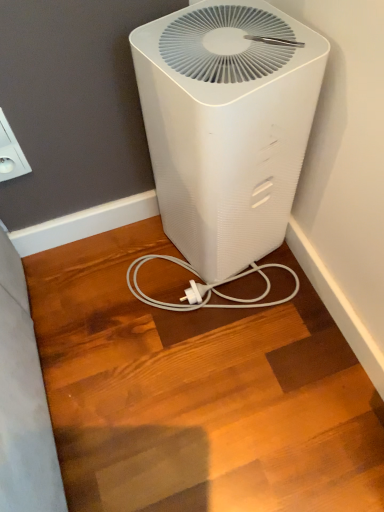
Question: Does white plastic air purifier at center turn towards white plastic outlet at upper left?

Choices:
 (A) yes
 (B) no

Answer: (B)

Question: Is white plastic air purifier at center bigger than white plastic outlet at upper left?

Choices:
 (A) yes
 (B) no

Answer: (A)

Question: Is white plastic air purifier at center shorter than white plastic outlet at upper left?

Choices:
 (A) no
 (B) yes

Answer: (A)

Question: Is white plastic air purifier at center not near white plastic outlet at upper left?

Choices:
 (A) no
 (B) yes

Answer: (A)

Question: Is white plastic outlet at upper left surrounded by white plastic air purifier at center?

Choices:
 (A) yes
 (B) no

Answer: (B)

Question: Is white plastic air purifier at center smaller than white plastic outlet at upper left?

Choices:
 (A) no
 (B) yes

Answer: (A)

Question: Considering the relative sizes of white plastic outlet at upper left and white plastic air purifier at center in the image provided, is white plastic outlet at upper left smaller than white plastic air purifier at center?

Choices:
 (A) yes
 (B) no

Answer: (A)

Question: Is white plastic outlet at upper left bigger than white plastic air purifier at center?

Choices:
 (A) no
 (B) yes

Answer: (A)

Question: Is white plastic outlet at upper left to the left of white plastic air purifier at center from the viewer's perspective?

Choices:
 (A) yes
 (B) no

Answer: (A)

Question: From a real-world perspective, is white plastic outlet at upper left positioned over white plastic air purifier at center based on gravity?

Choices:
 (A) no
 (B) yes

Answer: (B)

Question: Is white plastic outlet at upper left oriented away from white plastic air purifier at center?

Choices:
 (A) no
 (B) yes

Answer: (A)

Question: From a real-world perspective, is white plastic outlet at upper left located beneath white plastic air purifier at center?

Choices:
 (A) yes
 (B) no

Answer: (B)

Question: In terms of width, does white plastic outlet at upper left look wider or thinner when compared to white plastic air purifier at center?

Choices:
 (A) wide
 (B) thin

Answer: (B)